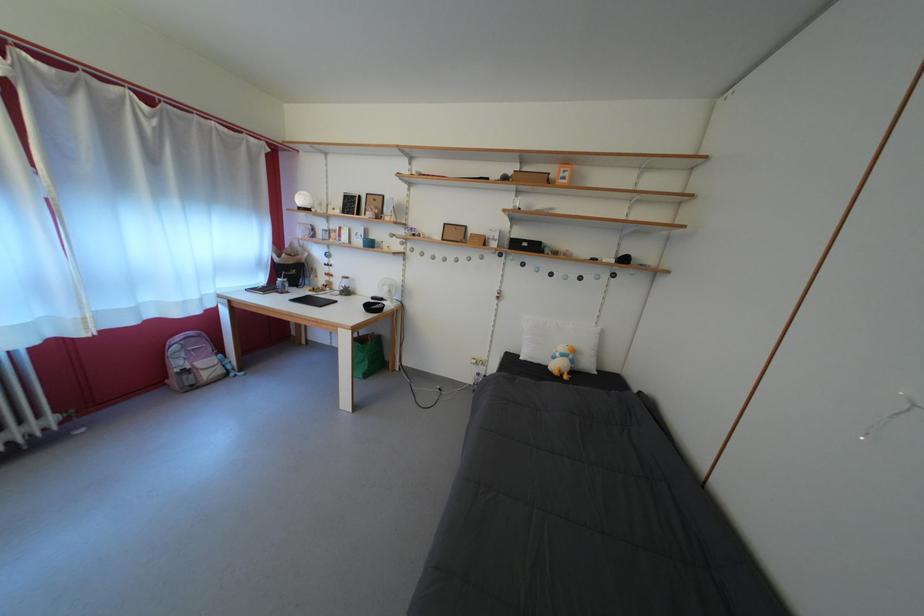
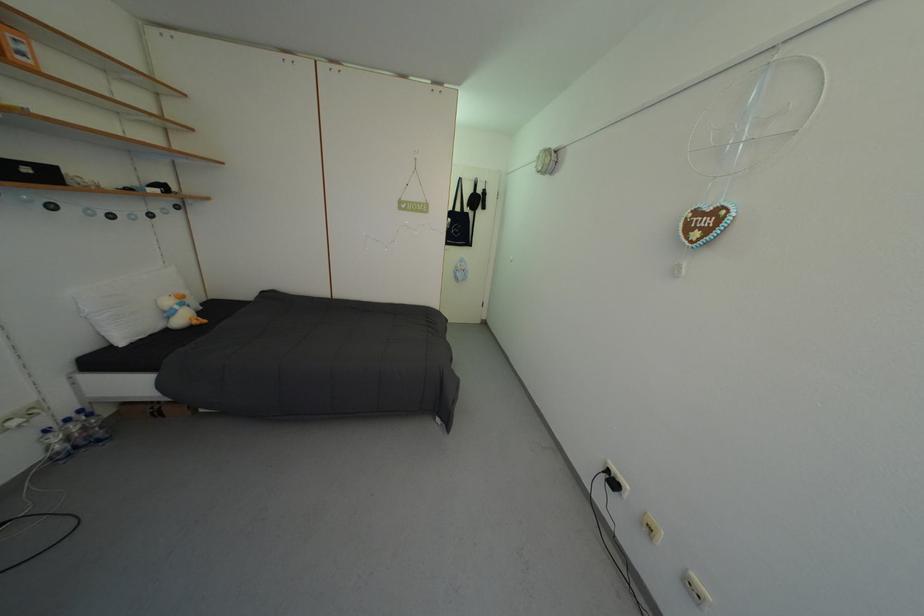
The point at (493, 383) is marked in the first image. Where is the corresponding point in the second image?

(76, 426)